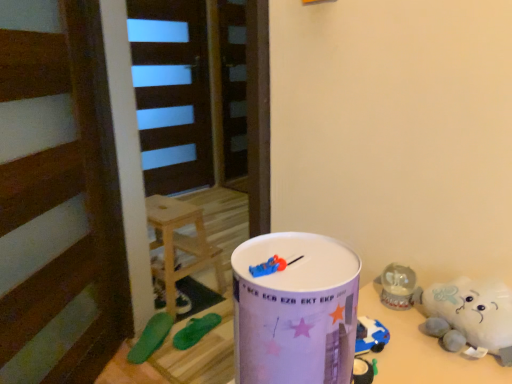
Question: Is green rubber toy at lower left, which is the 1th toy in back-to-front order, in front of or behind green rubber toy at lower left, marked as the third toy in a back-to-front arrangement, in the image?

Choices:
 (A) front
 (B) behind

Answer: (B)

Question: Which is correct: green rubber toy at lower left, arranged as the third toy when viewed from the front, is inside green rubber toy at lower left, marked as the third toy in a back-to-front arrangement, or outside of it?

Choices:
 (A) inside
 (B) outside

Answer: (B)

Question: Which object is positioned farthest from the white glossy milk can at center?

Choices:
 (A) green rubber flip-flops at lower left, the 2th toy viewed from the back
 (B) green rubber toy at lower left, marked as the third toy in a back-to-front arrangement
 (C) wooden stool at center
 (D) green rubber toy at lower left, arranged as the third toy when viewed from the front
 (E) white plush toy at lower right

Answer: (D)

Question: Estimate the real-world distances between objects in this image. Which object is closer to the green rubber toy at lower left, arranged as the third toy when viewed from the front?

Choices:
 (A) white glossy milk can at center
 (B) wooden stool at center
 (C) white plush toy at lower right
 (D) green rubber flip-flops at lower left, the 2th toy viewed from the back
 (E) green rubber toy at lower left, marked as the third toy in a back-to-front arrangement

Answer: (B)